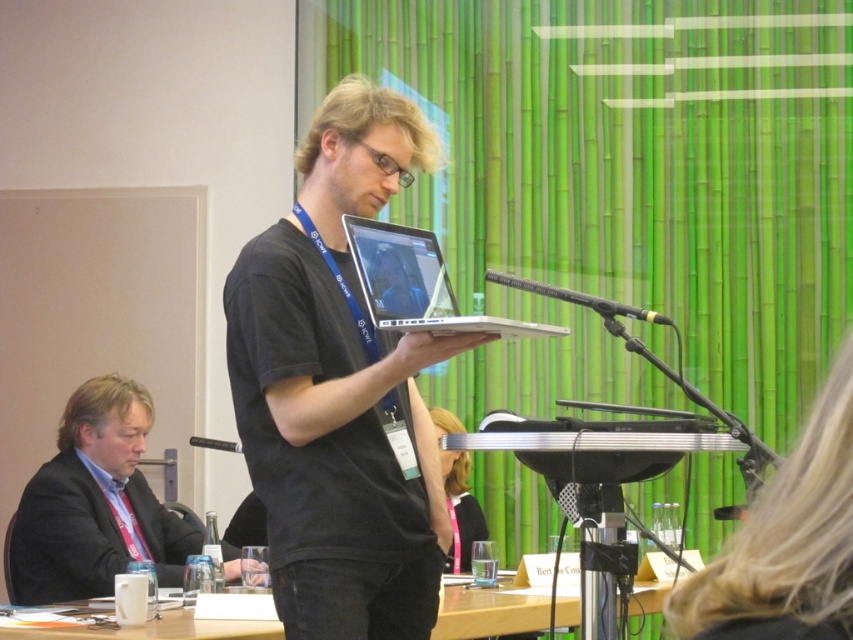
Who is more distant from viewer, (x=461, y=540) or (x=660, y=316)?

Positioned behind is point (x=461, y=540).

Does point (457, 492) come in front of point (646, 314)?

No, it is not.

Identify the location of matte black laptop at center. (461, 509).

Is dark suit at left further to camera compared to silver metallic laptop at center?

Yes, it is.

Can you confirm if dark suit at left is positioned above silver metallic laptop at center?

No.

Where is `dark suit at left`? The width and height of the screenshot is (853, 640). dark suit at left is located at coordinates (94, 502).

Where is `dark suit at left`? Image resolution: width=853 pixels, height=640 pixels. dark suit at left is located at coordinates (94, 502).

Describe the element at coordinates (339, 388) in the screenshot. This screenshot has height=640, width=853. I see `black matte laptop at center` at that location.

Does black matte laptop at center come behind wooden table at lower center?

No, black matte laptop at center is closer to the viewer.

Does point (271, 300) come farther from viewer compared to point (479, 625)?

That is False.

This screenshot has height=640, width=853. I want to click on black matte laptop at center, so click(339, 388).